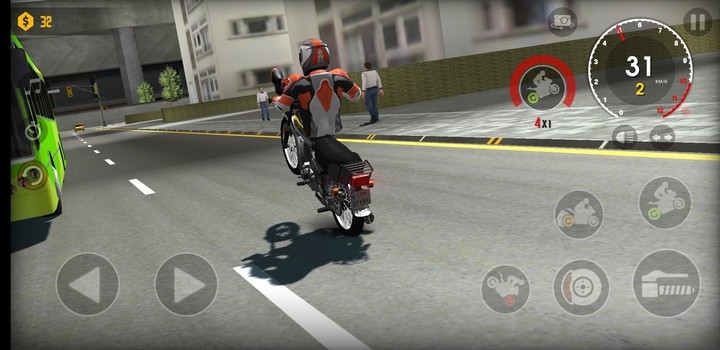
This screenshot has width=720, height=350. In order to click on seat in this screenshot , I will do `click(328, 148)`.